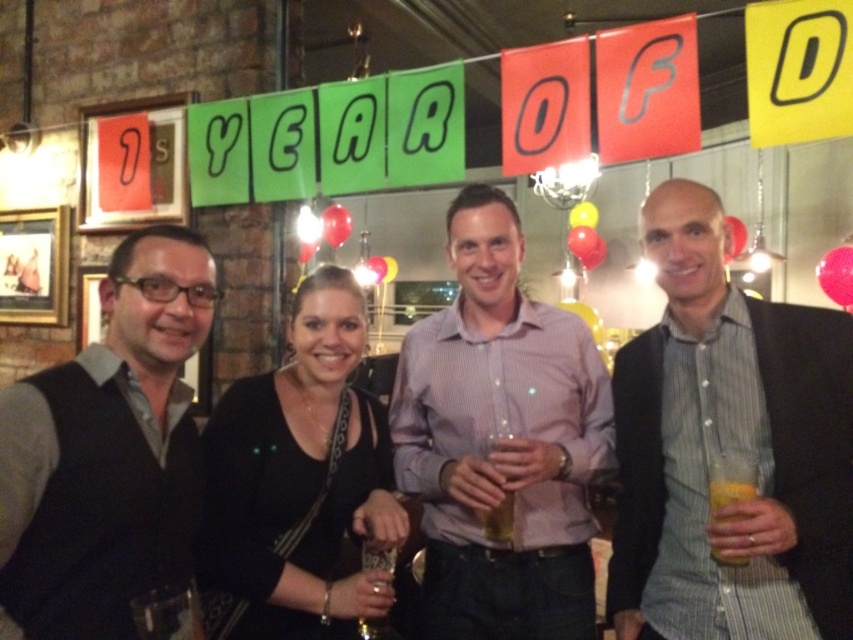
Question: Which point appears farthest from the camera in this image?

Choices:
 (A) (666, 196)
 (B) (331, 483)
 (C) (717, 556)

Answer: (B)

Question: Which point is farther to the camera?

Choices:
 (A) black leather jacket at center
 (B) purple striped shirt at center

Answer: (B)

Question: Among these objects, which one is farthest from the camera?

Choices:
 (A) black leather jacket at center
 (B) gray striped shirt at center

Answer: (A)

Question: Does gray striped shirt at center appear on the left side of translucent plastic cup at right?

Choices:
 (A) yes
 (B) no

Answer: (B)

Question: Is gray striped shirt at center above dark gray sweater vest at left?

Choices:
 (A) yes
 (B) no

Answer: (B)

Question: Does purple striped shirt at center have a larger size compared to translucent plastic cup at right?

Choices:
 (A) yes
 (B) no

Answer: (A)